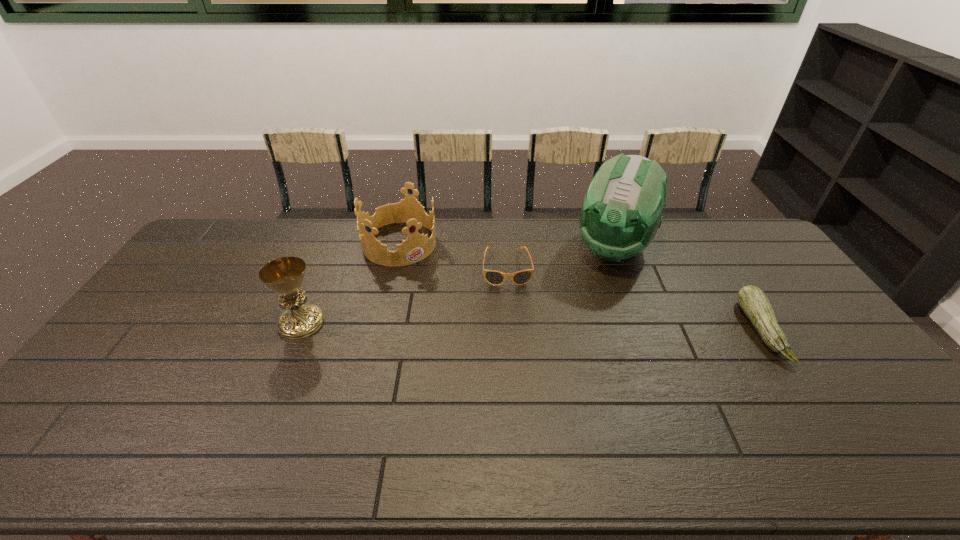
The height and width of the screenshot is (540, 960). I want to click on vacant point located on the visor of the tallest object, so click(598, 288).

Find the location of a particular element. Image resolution: width=960 pixels, height=540 pixels. blank space located 0.380m on the visor of the tallest object is located at coordinates (567, 355).

Image resolution: width=960 pixels, height=540 pixels. In order to click on free space located on the visor of the tallest object in this screenshot , I will do `click(579, 329)`.

Locate an element on the screen. This screenshot has width=960, height=540. free location located on the front-facing side of the shortest object is located at coordinates (510, 303).

What are the coordinates of `vacant region located 0.340m on the front-facing side of the shortest object` in the screenshot? It's located at (516, 371).

At what (x,y) coordinates should I click in order to perform the action: click on vacant space located on the front-facing side of the shortest object. Please return your answer as a coordinate pair (x, y). The image size is (960, 540). Looking at the image, I should click on (516, 377).

You are a GUI agent. You are given a task and a screenshot of the screen. Output one action in this format:
    pyautogui.click(x=<x>, y=<y>)
    Task: Click on the blank space located on the front-facing side of the fourth object from right to left
    The height and width of the screenshot is (540, 960).
    Given the screenshot: What is the action you would take?
    pyautogui.click(x=475, y=325)

Where is `vacant space located 0.120m on the front-facing side of the fourth object from right to left`? The width and height of the screenshot is (960, 540). vacant space located 0.120m on the front-facing side of the fourth object from right to left is located at coordinates (435, 281).

Find the location of a particular element. vacant position located on the front-facing side of the fourth object from right to left is located at coordinates (427, 273).

Identify the location of football helmet located at the far edge. This screenshot has width=960, height=540. (621, 212).